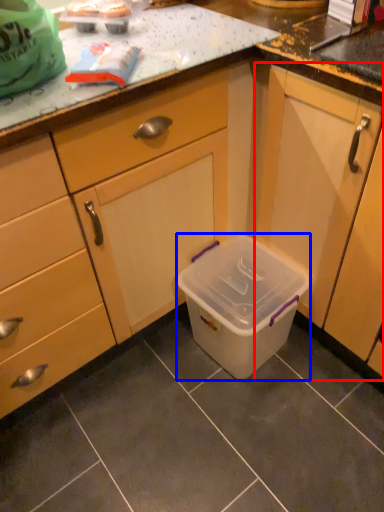
Question: Which point is further to the camera, cabinetry (highlighted by a red box) or storage box (highlighted by a blue box)?

Choices:
 (A) cabinetry
 (B) storage box

Answer: (B)